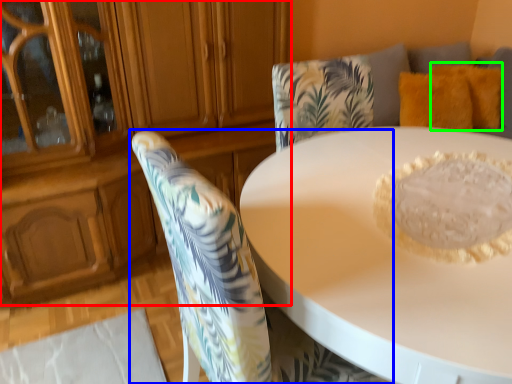
Question: Which is farther away from dresser (highlighted by a red box)? chair (highlighted by a blue box) or pillow (highlighted by a green box)?

Choices:
 (A) chair
 (B) pillow

Answer: (B)